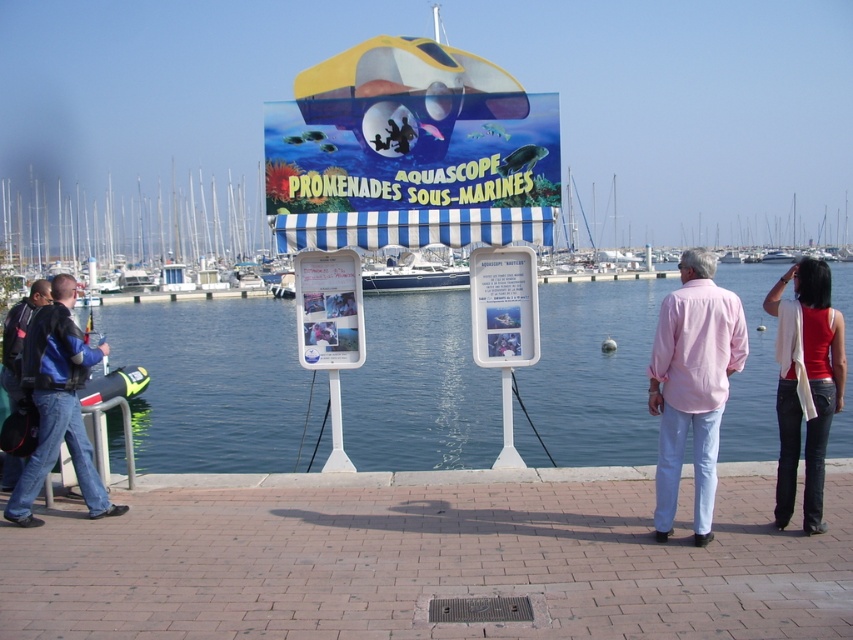
Question: Does pink cotton shirt at center have a smaller size compared to matte plastic poster at center?

Choices:
 (A) yes
 (B) no

Answer: (B)

Question: Which of these objects is positioned farthest from the clear blue water at center?

Choices:
 (A) matte plastic poster at center
 (B) pink cotton shirt at center
 (C) blue denim jeans at lower left
 (D) red cotton tank top at right

Answer: (D)

Question: Which of the following is the closest to the observer?

Choices:
 (A) (200, 180)
 (B) (215, 314)

Answer: (B)

Question: In this image, where is clear blue water at center located relative to blue denim jeans at lower left?

Choices:
 (A) right
 (B) left

Answer: (A)

Question: Does blue denim jeans at lower left have a lesser width compared to matte plastic poster at center?

Choices:
 (A) yes
 (B) no

Answer: (B)

Question: Considering the real-world distances, which object is closest to the white plastic boat at left?

Choices:
 (A) red cotton tank top at right
 (B) brick at lower center

Answer: (B)